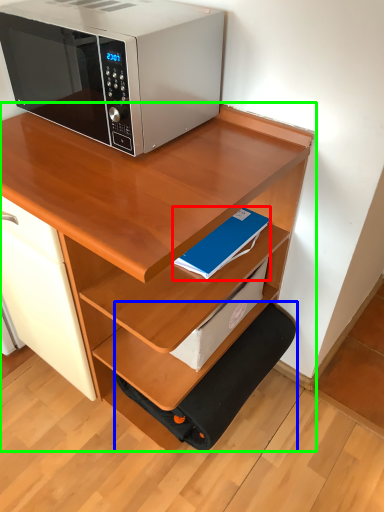
Question: Estimate the real-world distances between objects in this image. Which object is closer to paperback book (highlighted by a red box), step stool (highlighted by a blue box) or desk (highlighted by a green box)?

Choices:
 (A) step stool
 (B) desk

Answer: (B)